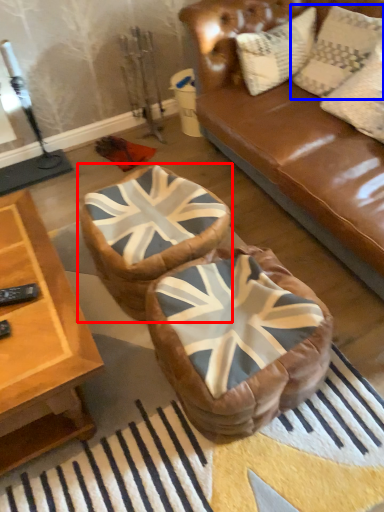
Question: Among these objects, which one is farthest to the camera, bean bag chair (highlighted by a red box) or pillow (highlighted by a blue box)?

Choices:
 (A) bean bag chair
 (B) pillow

Answer: (B)